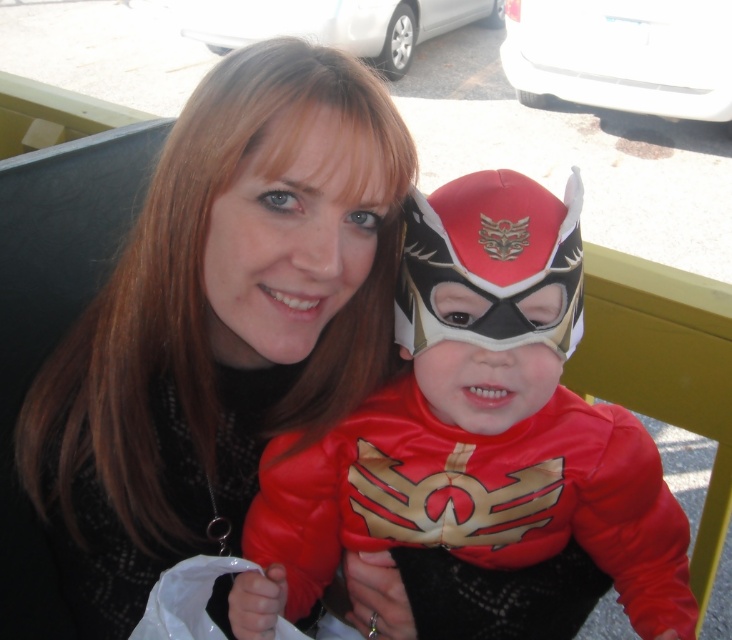
Who is higher up, matte black hair at upper center or shiny red costume at center?

Positioned higher is matte black hair at upper center.

Is matte black hair at upper center closer to camera compared to shiny red costume at center?

Yes, it is in front of shiny red costume at center.

The image size is (732, 640). In order to click on matte black hair at upper center in this screenshot , I will do `click(220, 321)`.